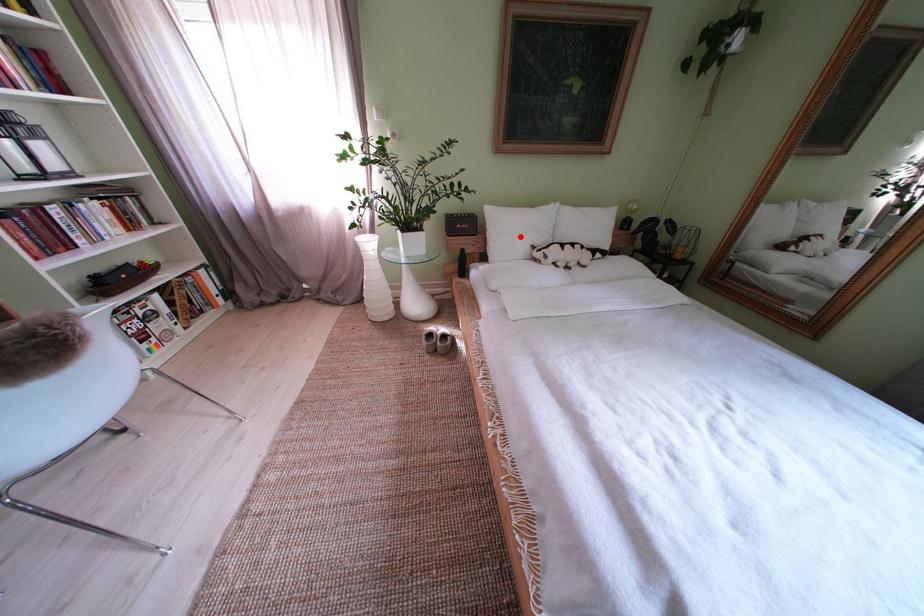
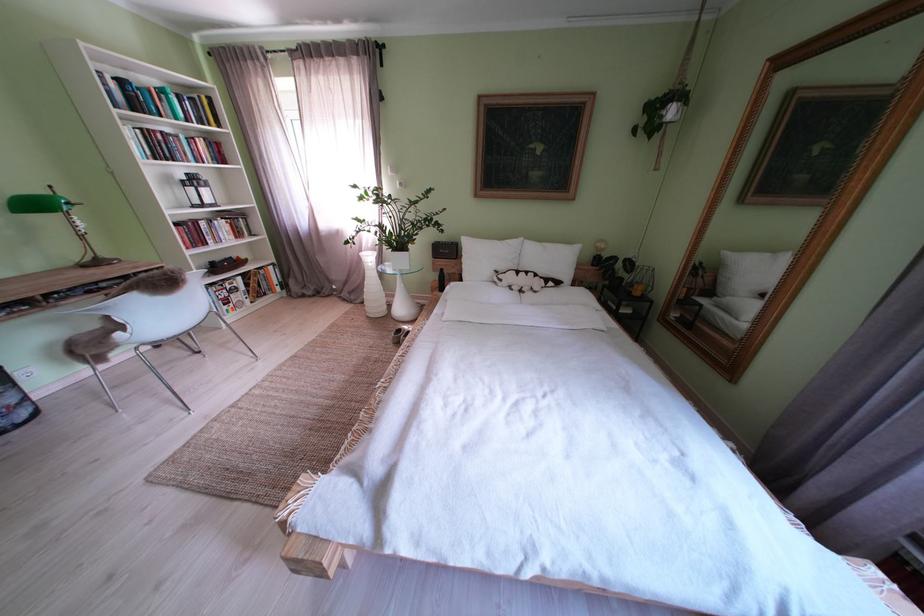
Locate, in the second image, the point that corresponds to the highlighted location in the first image.

(490, 262)